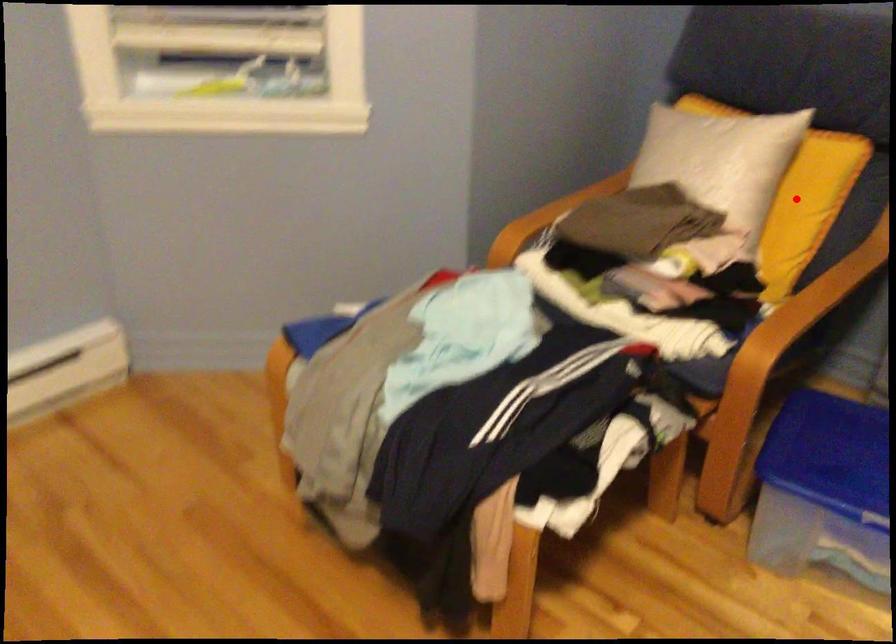
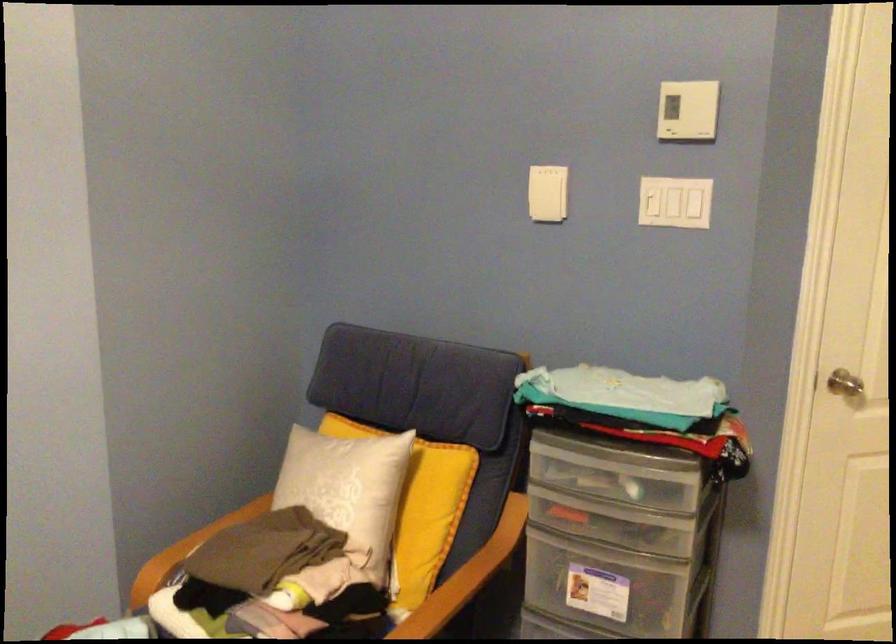
Find the pixel in the second image that matches the highlighted location in the first image.

(419, 507)